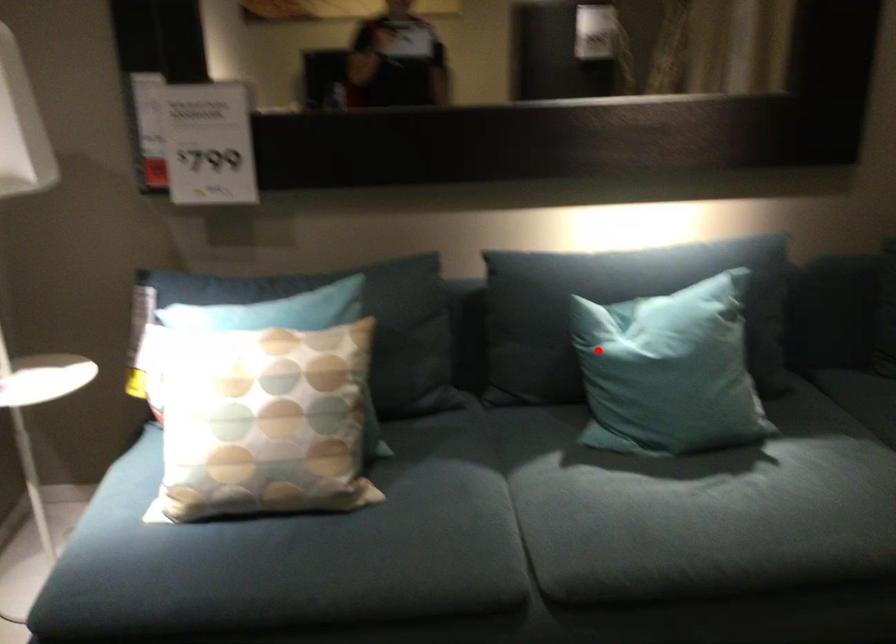
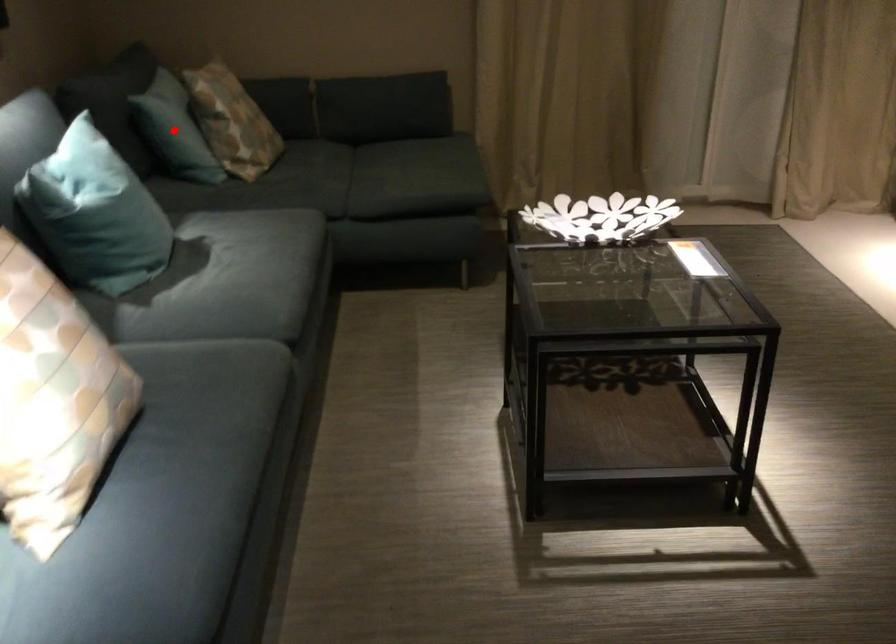
I am providing you with two images of the same scene from different viewpoints. A red point is marked on the first image and another point is marked on the second image. Are the points marked in image1 and image2 representing the same 3D position?

No